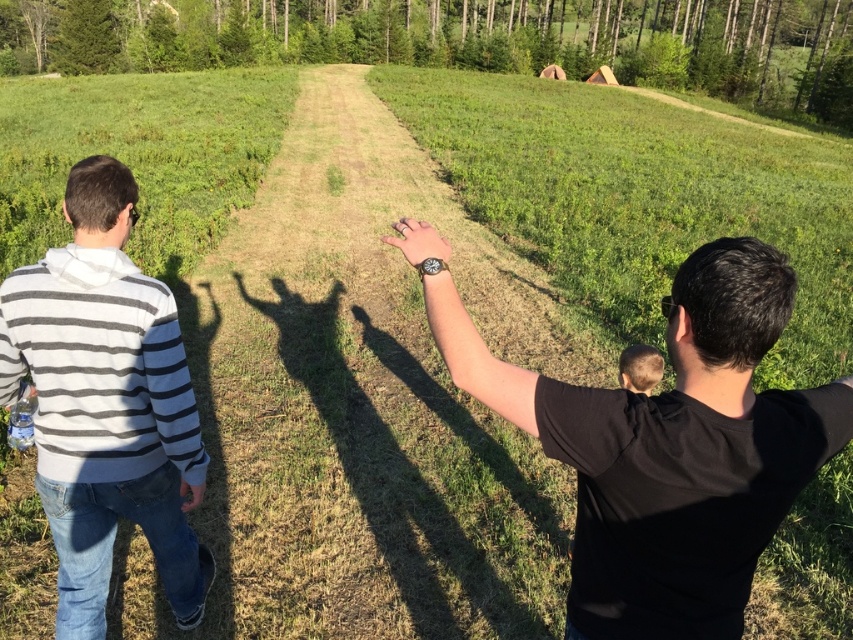
You are a photographer positioned at the back of the field. You want to take a photo that includes both the black matte shirt at center and the white striped hoodie at left. Which object should you adjust your focus on first to ensure both are in the frame?

The black matte shirt at center is closer to the viewer than the white striped hoodie at left, so you should focus on the black matte shirt at center first to ensure both are in the frame.

You are standing at the point with coordinates point (757, 550) and want to walk to the point with coordinates point (94, 522). Which direction should you move to get closer to your destination?

Since point (757, 550) is closer to the viewer than point (94, 522), you should move away from the viewer to reach your destination.

Based on the photo, you are a delivery drone that needs to fly from the white striped hoodie at left to the matte black watch at center. What is the minimum distance you must travel?

The minimum distance you must travel is 4.41 feet, as the white striped hoodie at left is 4.41 feet away from the matte black watch at center.